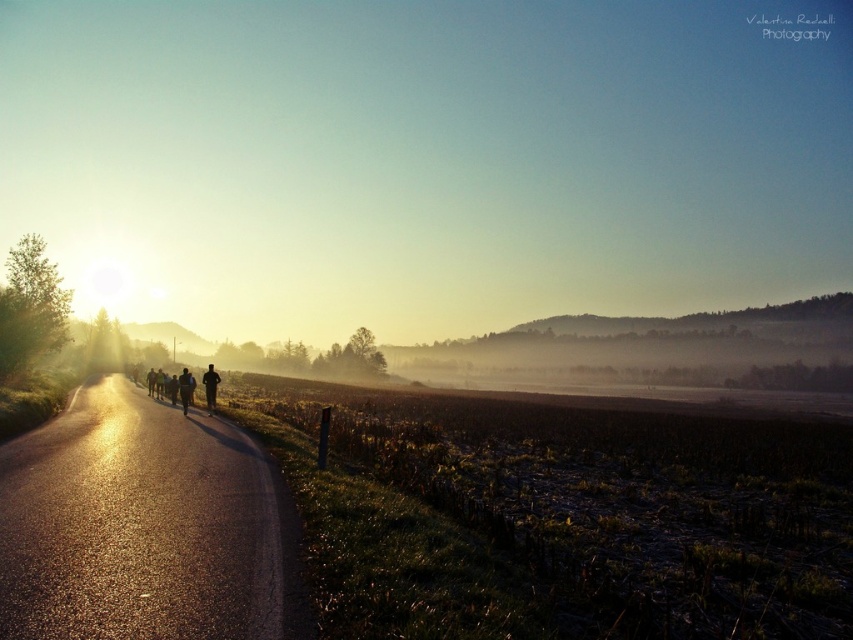
You are standing at the edge of the asphalt road at center and want to walk to a nearby bench located 20 feet away in the same direction as the road curves. Can you reach the bench without crossing the road?

The asphalt road at center is 17.52 feet from viewer, so the bench is 2.48 feet beyond the road. Since the road curves in the same direction, you can walk along the road to reach the bench without crossing it.

Consider the image. You are a pedestrian standing at the edge of the matte asphalt road at left. You want to cross the road to reach a nearby park. Which direction should you walk to avoid the silhouette running at left?

The matte asphalt road at left is to the right of the silhouette running at left, so you should walk to the left to avoid the silhouette running at left and safely cross the road.

You are a cyclist approaching the asphalt road at center where a person in a dark blue running suit at center is walking. Can you safely pass the person on the same side of the road without crossing the center line?

The asphalt road at center might be wider than dark blue running suit at center, so it is possible that the cyclist can safely pass the person on the same side without crossing the center line, but the exact width is uncertain based on the available information.